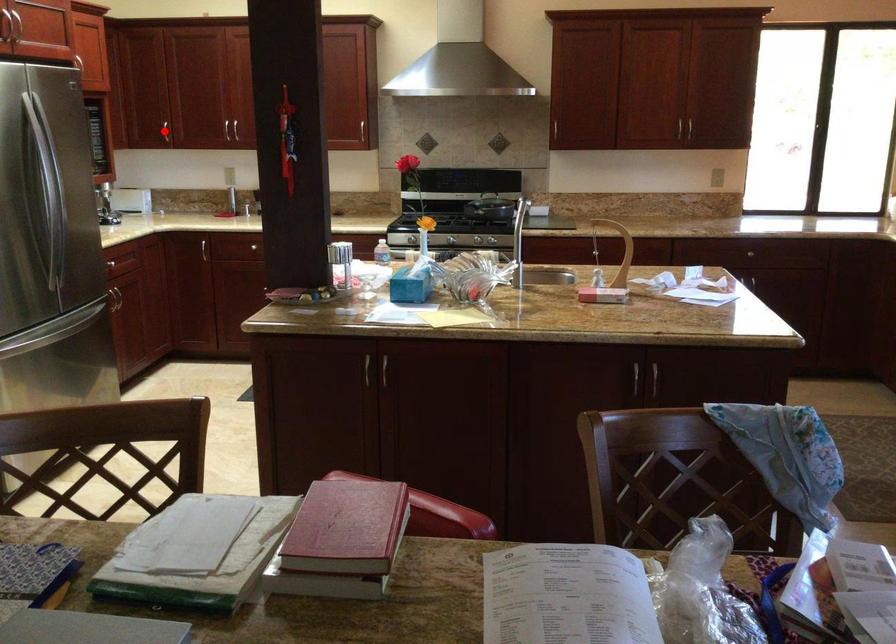
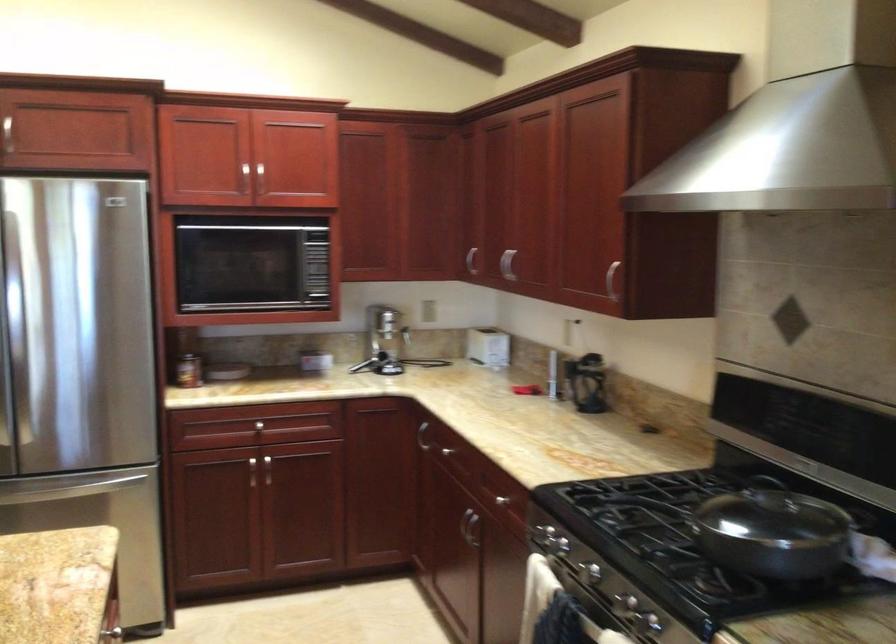
Question: I am providing you with two images of the same scene from different viewpoints. A red point is marked on the first image. At the location where the point appears in image 1, is it still visible in image 2?

Choices:
 (A) Yes
 (B) No

Answer: (B)